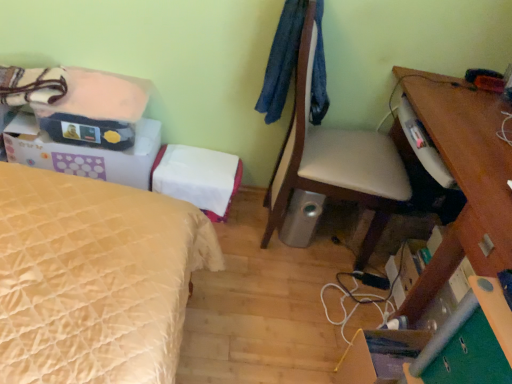
Question: Is matte cardboard box at lower right, the first storage box in the right-to-left sequence, in front of matte black bag at upper left?

Choices:
 (A) yes
 (B) no

Answer: (A)

Question: Is there a large distance between matte cardboard box at lower right, which is counted as the third storage box, starting from the left, and matte black bag at upper left?

Choices:
 (A) yes
 (B) no

Answer: (A)

Question: Is the depth of matte cardboard box at lower right, the first storage box in the right-to-left sequence, greater than that of matte black bag at upper left?

Choices:
 (A) no
 (B) yes

Answer: (A)

Question: Considering the relative positions of matte cardboard box at lower right, the first storage box in the right-to-left sequence, and matte black bag at upper left in the image provided, is matte cardboard box at lower right, the first storage box in the right-to-left sequence, to the right of matte black bag at upper left from the viewer's perspective?

Choices:
 (A) no
 (B) yes

Answer: (B)

Question: Is matte cardboard box at lower right, the 1th storage box from the bottom, not inside matte black bag at upper left?

Choices:
 (A) no
 (B) yes

Answer: (B)

Question: Is wooden desk at right in front of or behind silver metallic speaker at lower center in the image?

Choices:
 (A) front
 (B) behind

Answer: (A)

Question: In terms of height, does wooden desk at right look taller or shorter compared to silver metallic speaker at lower center?

Choices:
 (A) tall
 (B) short

Answer: (A)

Question: From a real-world perspective, relative to silver metallic speaker at lower center, is wooden desk at right vertically above or below?

Choices:
 (A) above
 (B) below

Answer: (A)

Question: Is point (458, 105) positioned closer to the camera than point (294, 201)?

Choices:
 (A) closer
 (B) farther

Answer: (A)

Question: Is silver metallic speaker at lower center wider or thinner than white fabric storage box at center, placed as the second storage box when sorted from bottom to top?

Choices:
 (A) thin
 (B) wide

Answer: (A)

Question: From the image's perspective, relative to white fabric storage box at center, which is counted as the second storage box, starting from the top, is silver metallic speaker at lower center above or below?

Choices:
 (A) below
 (B) above

Answer: (A)

Question: Is silver metallic speaker at lower center spatially inside white fabric storage box at center, the 2th storage box when ordered from right to left, or outside of it?

Choices:
 (A) outside
 (B) inside

Answer: (A)

Question: Considering the positions of point (312, 213) and point (158, 165), is point (312, 213) closer or farther from the camera than point (158, 165)?

Choices:
 (A) closer
 (B) farther

Answer: (A)

Question: From the image's perspective, relative to silver metallic speaker at lower center, is green felt drawer at lower right above or below?

Choices:
 (A) below
 (B) above

Answer: (A)

Question: From their relative heights in the image, would you say green felt drawer at lower right is taller or shorter than silver metallic speaker at lower center?

Choices:
 (A) short
 (B) tall

Answer: (A)